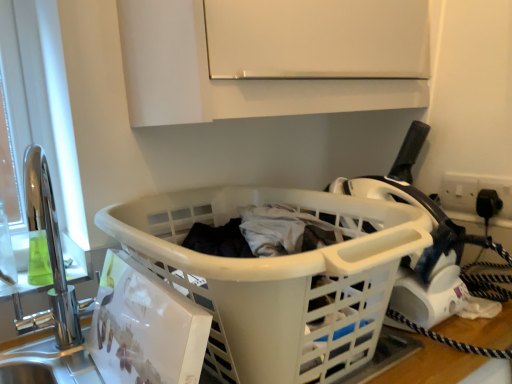
Question: Looking at their shapes, would you say white plastic laundry basket at center is wider or thinner than white matte cabinet at upper center?

Choices:
 (A) wide
 (B) thin

Answer: (A)

Question: Is white plastic laundry basket at center spatially inside white matte cabinet at upper center, or outside of it?

Choices:
 (A) outside
 (B) inside

Answer: (A)

Question: Is white plastic laundry basket at center taller or shorter than white matte cabinet at upper center?

Choices:
 (A) short
 (B) tall

Answer: (A)

Question: From the image's perspective, is white matte cabinet at upper center above or below white plastic laundry basket at center?

Choices:
 (A) above
 (B) below

Answer: (A)

Question: From a real-world perspective, is white matte cabinet at upper center above or below white plastic laundry basket at center?

Choices:
 (A) below
 (B) above

Answer: (B)

Question: Considering the positions of white matte cabinet at upper center and white plastic laundry basket at center in the image, is white matte cabinet at upper center taller or shorter than white plastic laundry basket at center?

Choices:
 (A) short
 (B) tall

Answer: (B)

Question: In terms of size, does white matte cabinet at upper center appear bigger or smaller than white plastic laundry basket at center?

Choices:
 (A) big
 (B) small

Answer: (A)